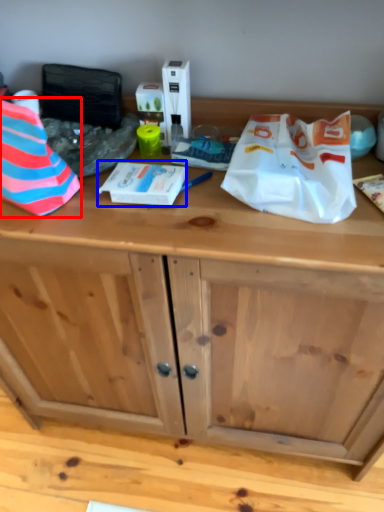
Question: Among these objects, which one is nearest to the camera, wrapping paper (highlighted by a red box) or wrapping paper (highlighted by a blue box)?

Choices:
 (A) wrapping paper
 (B) wrapping paper

Answer: (A)